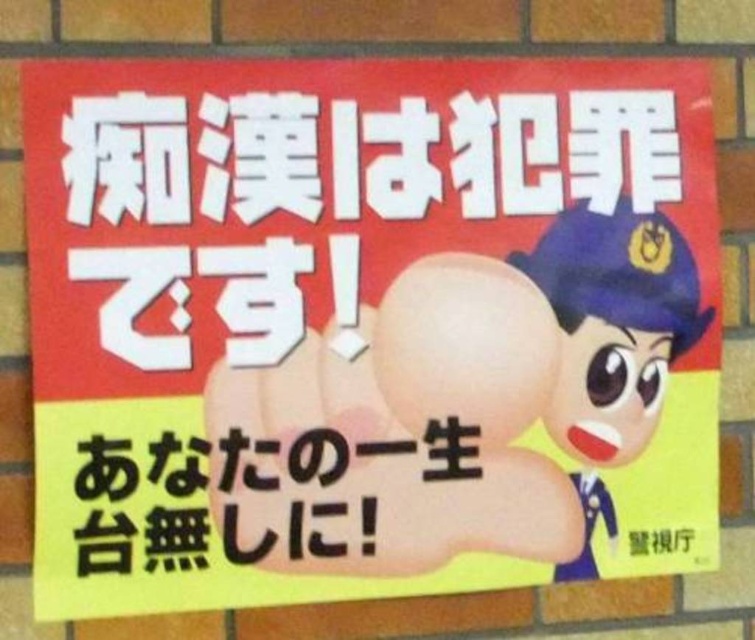
Based on the photo, where is the shiny blue uniform at right located in the poster?

The shiny blue uniform at right is located at point (612, 344) in the poster.

You have a ruler that measures 6 inches. You want to measure the distance between the shiny blue uniform at right and the black paper at lower center. Will your ruler be long enough?

The shiny blue uniform at right and the black paper at lower center are 6.81 inches apart. Since your ruler is only 6 inches long, it is not long enough to measure the full distance between them.

You are an artist who wants to draw the shiny blue uniform at right and the black paper at lower center from the poster. Which object should you draw first if you want to follow the order from top to bottom?

The shiny blue uniform at right should be drawn first because it is positioned over the black paper at lower center, indicating it is higher up in the poster.